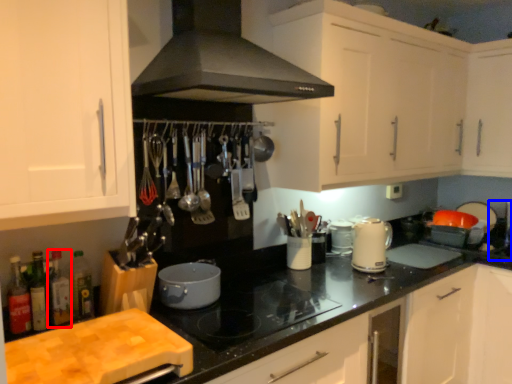
Question: Which of the following is the closest to the observer, bottle (highlighted by a red box) or sink (highlighted by a blue box)?

Choices:
 (A) bottle
 (B) sink

Answer: (A)